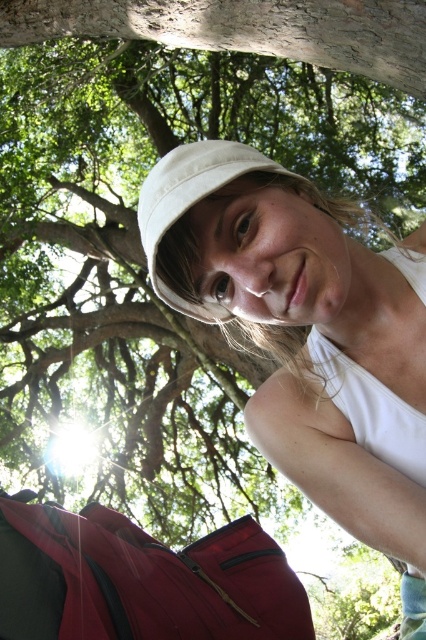
Does matte red backpack at lower left have a greater height compared to white cotton hat at center?

No, matte red backpack at lower left is not taller than white cotton hat at center.

Does matte red backpack at lower left come in front of white cotton hat at center?

No, it is not.

Where is `matte red backpack at lower left`? This screenshot has width=426, height=640. matte red backpack at lower left is located at coordinates (140, 579).

You are a GUI agent. You are given a task and a screenshot of the screen. Output one action in this format:
    pyautogui.click(x=<x>, y=<y>)
    Task: Click on the matte red backpack at lower left
    The image size is (426, 640).
    Given the screenshot: What is the action you would take?
    tap(140, 579)

Between white matte hat at center and matte red backpack at lower left, which one has less height?

Standing shorter between the two is matte red backpack at lower left.

Is white matte hat at center closer to the viewer compared to matte red backpack at lower left?

Yes, white matte hat at center is closer to the viewer.

Between point (288, 202) and point (137, 532), which one is positioned behind?

Positioned behind is point (137, 532).

I want to click on white matte hat at center, so click(307, 336).

Who is lower down, matte red backpack at lower left or smooth bark tree trunk at upper center?

matte red backpack at lower left is lower down.

How distant is matte red backpack at lower left from smooth bark tree trunk at upper center?

1.57 meters

Locate an element on the screen. This screenshot has height=640, width=426. matte red backpack at lower left is located at coordinates (140, 579).